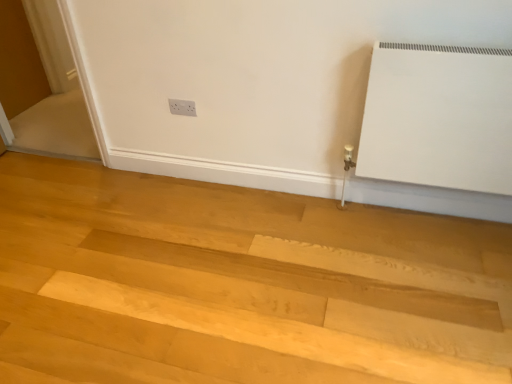
Question: Is natural wood floor at lower center oriented towards white glossy screen door at left?

Choices:
 (A) no
 (B) yes

Answer: (A)

Question: Does natural wood floor at lower center come in front of white glossy screen door at left?

Choices:
 (A) no
 (B) yes

Answer: (B)

Question: Would you consider natural wood floor at lower center to be distant from white glossy screen door at left?

Choices:
 (A) yes
 (B) no

Answer: (A)

Question: Is white glossy screen door at left a part of natural wood floor at lower center?

Choices:
 (A) no
 (B) yes

Answer: (A)

Question: From the image's perspective, does natural wood floor at lower center appear higher than white glossy screen door at left?

Choices:
 (A) no
 (B) yes

Answer: (A)

Question: Would you say natural wood floor at lower center is inside or outside white plastic electric outlet at upper center?

Choices:
 (A) inside
 (B) outside

Answer: (B)

Question: Relative to white plastic electric outlet at upper center, is natural wood floor at lower center in front or behind?

Choices:
 (A) behind
 (B) front

Answer: (B)

Question: From a real-world perspective, is natural wood floor at lower center physically located above or below white plastic electric outlet at upper center?

Choices:
 (A) below
 (B) above

Answer: (A)

Question: In terms of width, does natural wood floor at lower center look wider or thinner when compared to white plastic electric outlet at upper center?

Choices:
 (A) wide
 (B) thin

Answer: (A)

Question: From a real-world perspective, is white glossy screen door at left physically located above or below natural wood floor at lower center?

Choices:
 (A) below
 (B) above

Answer: (B)

Question: Choose the correct answer: Is white glossy screen door at left inside natural wood floor at lower center or outside it?

Choices:
 (A) inside
 (B) outside

Answer: (B)

Question: Is white glossy screen door at left in front of or behind natural wood floor at lower center in the image?

Choices:
 (A) front
 (B) behind

Answer: (B)

Question: Considering the positions of white glossy screen door at left and natural wood floor at lower center in the image, is white glossy screen door at left bigger or smaller than natural wood floor at lower center?

Choices:
 (A) big
 (B) small

Answer: (B)

Question: Is natural wood floor at lower center spatially inside white glossy screen door at left, or outside of it?

Choices:
 (A) inside
 (B) outside

Answer: (B)

Question: Is natural wood floor at lower center in front of or behind white glossy screen door at left in the image?

Choices:
 (A) front
 (B) behind

Answer: (A)